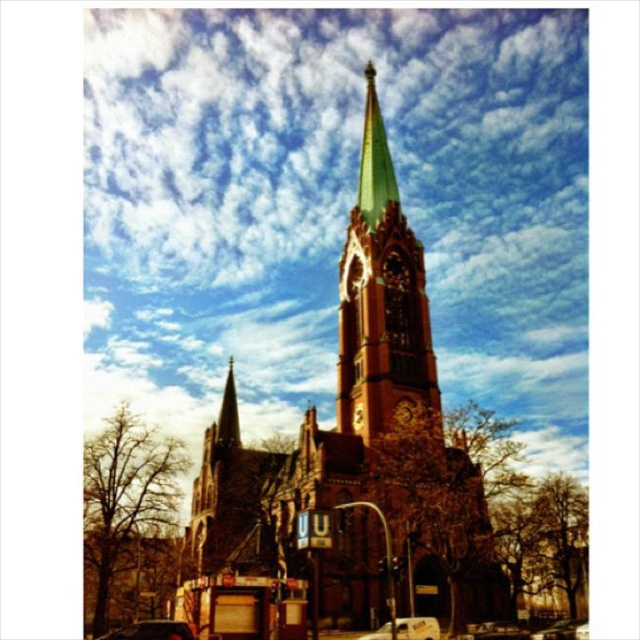
Between point (109, 634) and point (476, 628), which one is positioned in front?

Point (476, 628) is more forward.

Between metallic silver car at lower left and metallic silver car at center, which one appears on the right side from the viewer's perspective?

Positioned to the right is metallic silver car at center.

Is point (148, 628) behind point (508, 634)?

No, it is in front of (508, 634).

This screenshot has width=640, height=640. Find the location of `metallic silver car at lower left`. metallic silver car at lower left is located at coordinates (154, 630).

Is metallic silver car at lower left shorter than white plastic car at lower center?

No.

Which is above, metallic silver car at lower left or white plastic car at lower center?

Positioned higher is white plastic car at lower center.

Where is `metallic silver car at lower left`? The image size is (640, 640). metallic silver car at lower left is located at coordinates (154, 630).

Which is above, brown brick church at center or metallic silver car at center?

brown brick church at center

In the scene shown: Measure the distance between point (480, 538) and camera.

The distance of point (480, 538) from camera is 72.72 meters.

Between point (340, 435) and point (515, 636), which one is positioned in front?

Point (340, 435) is in front.

Locate an element on the screen. This screenshot has width=640, height=640. brown brick church at center is located at coordinates (346, 476).